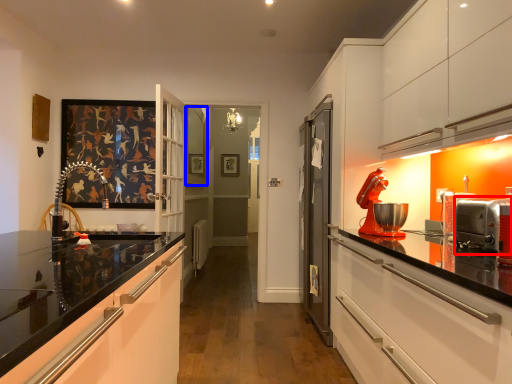
Question: Which point is closer to the camera, appliance (highlighted by a red box) or window (highlighted by a blue box)?

Choices:
 (A) appliance
 (B) window

Answer: (A)